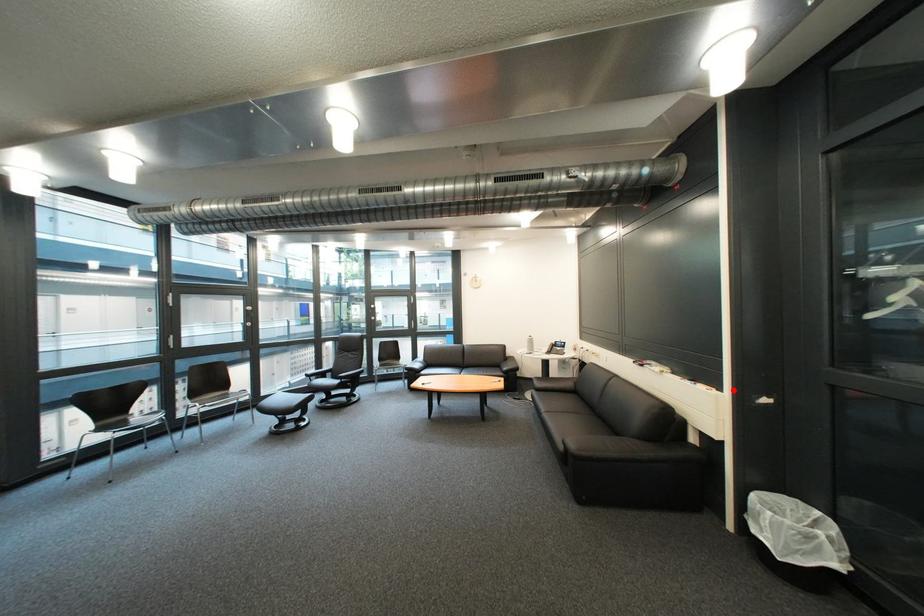
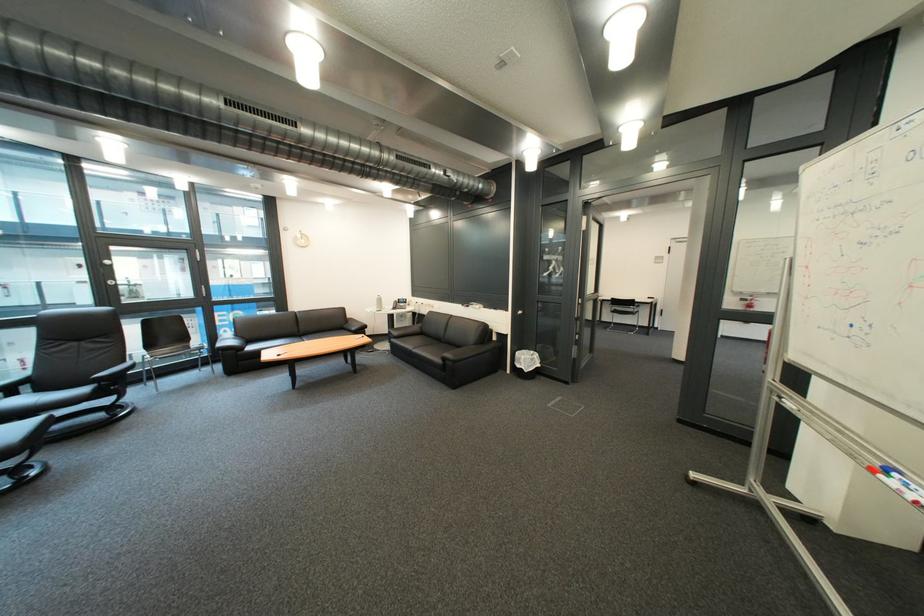
The point at the highlighted location is marked in the first image. Where is the corresponding point in the second image?

(520, 312)